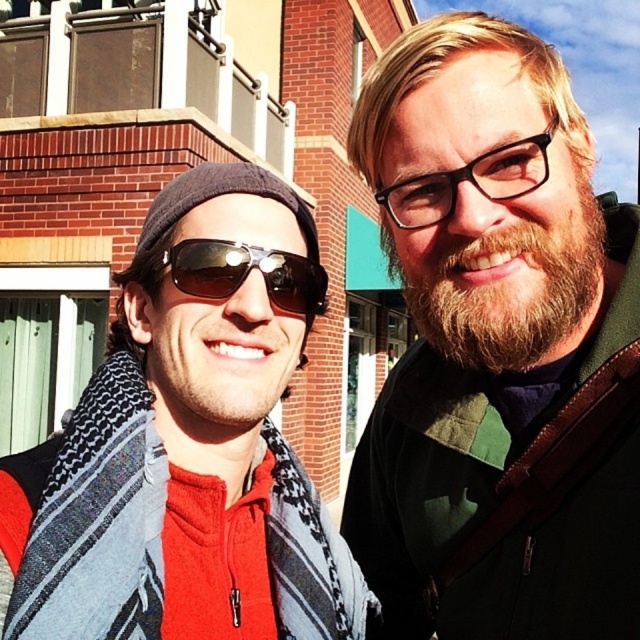
From the picture: You are taking a photo of two people standing near a brick building. You want to focus on the person at point (576, 316) and the person at point (323, 307). Which person is closer to your camera?

The person at point (576, 316) is closer to the camera than the person at point (323, 307).

You are a photographer trying to capture a closeup shot of the sunglasses at center while also including the gray woven scarf at left in the frame. Given the distance between them, do you think you can fit both in the same photo without moving the subjects?

The distance between the gray woven scarf at left and the sunglasses at center is 23.93 inches, so yes, you can fit both in the same photo without moving the subjects as this distance is manageable for a closeup shot.

You are a photographer trying to capture a photo of the bearded man at center and the gray woven scarf at left. Based on their positions, which object is located to the right side of the other?

The bearded man at center is to the right of the gray woven scarf at left.